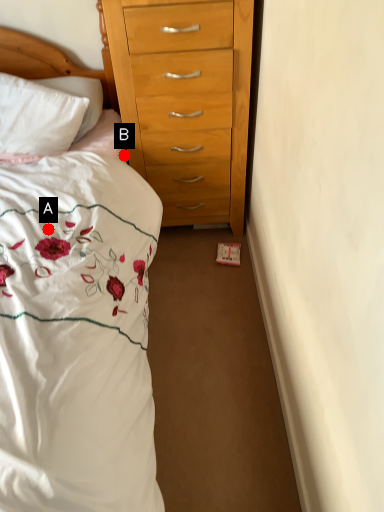
Question: Two points are circled on the image, labeled by A and B beside each circle. Which point is closer to the camera?

Choices:
 (A) A is closer
 (B) B is closer

Answer: (A)